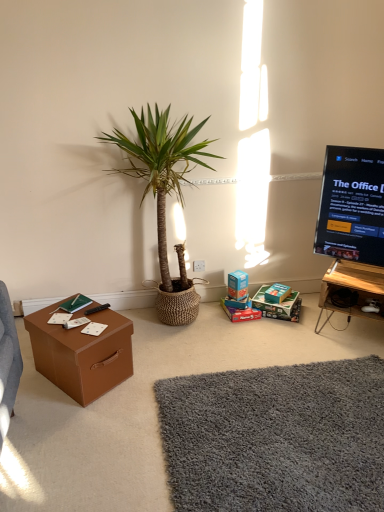
This screenshot has height=512, width=384. What are the coordinates of `vacant point above brown cardboard box at lower left (from a real-world perspective)` in the screenshot? It's located at (75, 320).